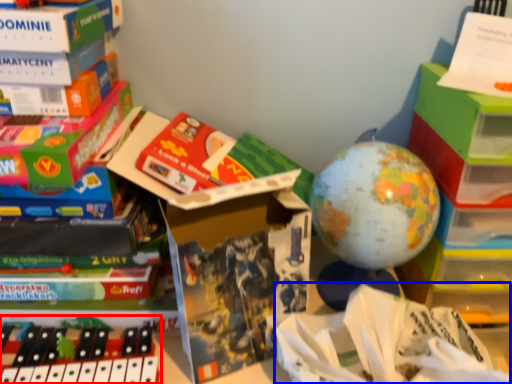
Question: Among these objects, which one is farthest to the camera, toy (highlighted by a red box) or wrapping paper (highlighted by a blue box)?

Choices:
 (A) toy
 (B) wrapping paper

Answer: (A)